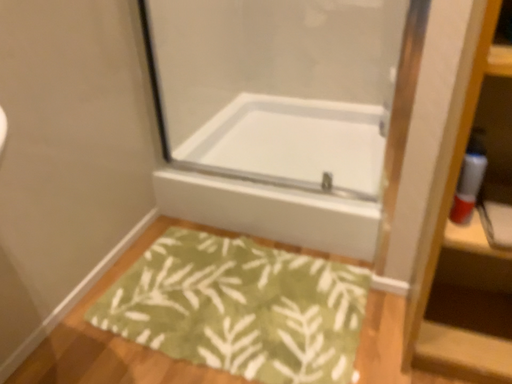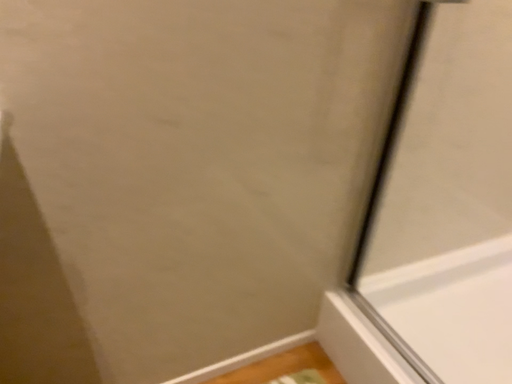
Question: Which way did the camera rotate in the video?

Choices:
 (A) rotated downward
 (B) rotated upward

Answer: (B)